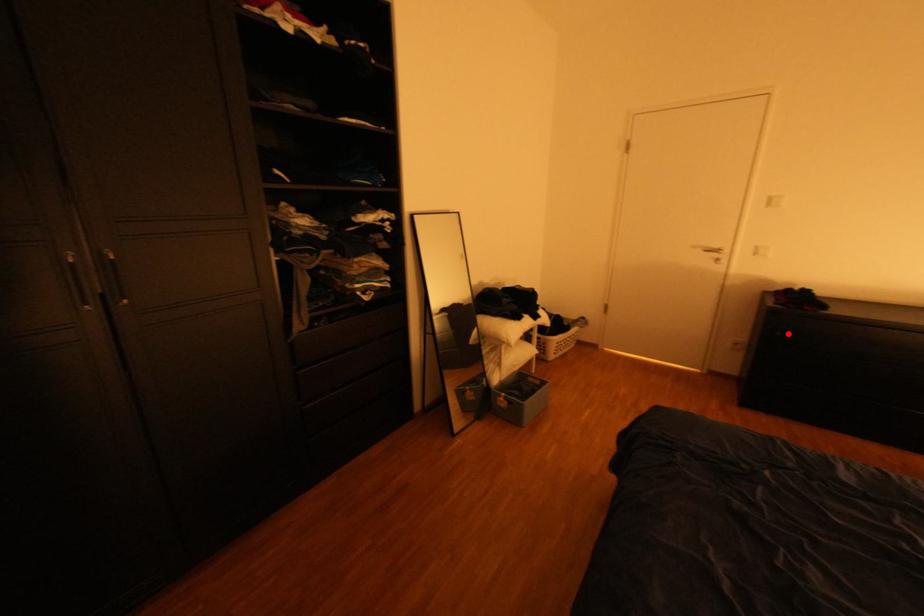
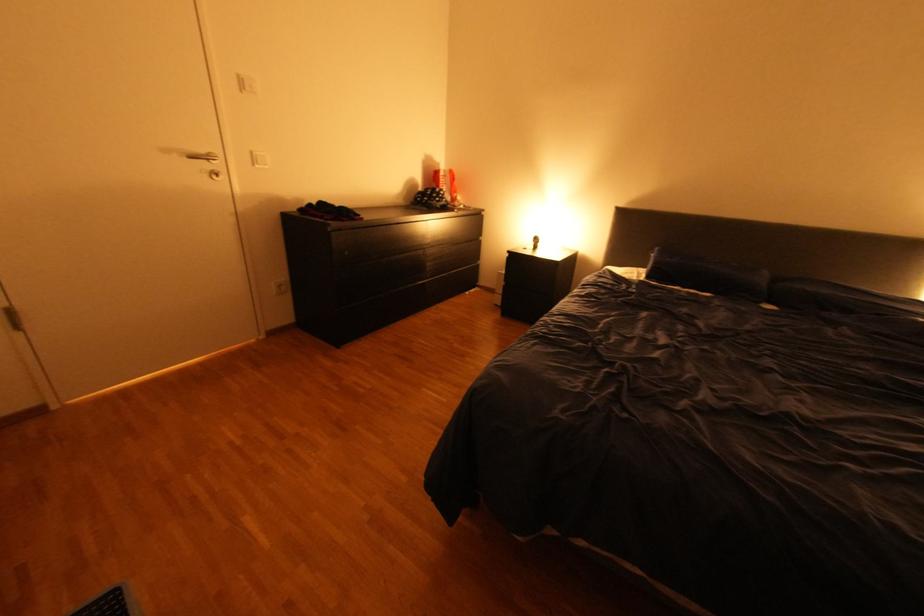
In the second image, find the point that corresponds to the highlighted location in the first image.

(357, 253)